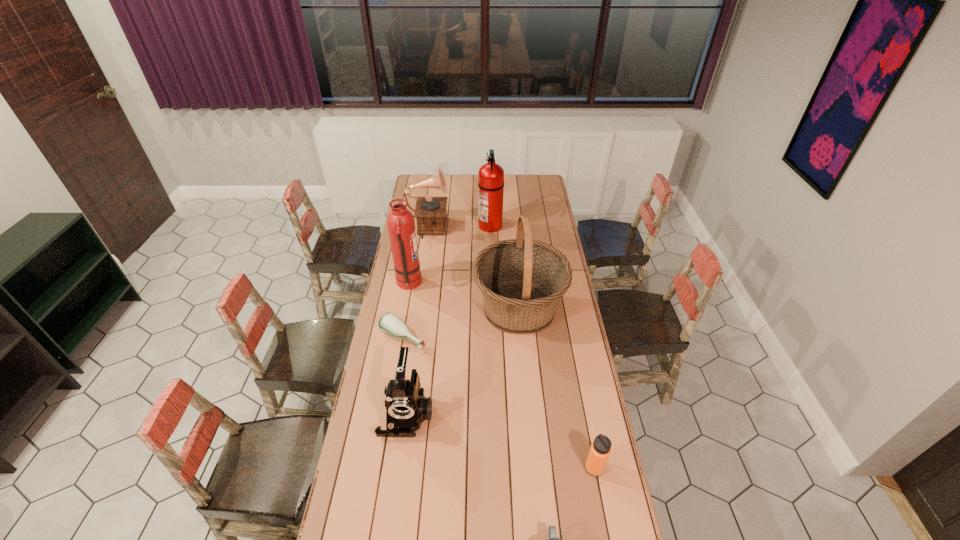
This screenshot has width=960, height=540. In order to click on camcorder that is at the left edge in this screenshot , I will do `click(406, 406)`.

The width and height of the screenshot is (960, 540). Identify the location of bottle that is at the left edge. (392, 325).

The width and height of the screenshot is (960, 540). In order to click on basket that is at the right edge in this screenshot , I will do `click(522, 280)`.

Where is `thermos bottle situated at the right edge`? This screenshot has height=540, width=960. thermos bottle situated at the right edge is located at coordinates (600, 449).

The height and width of the screenshot is (540, 960). Find the location of `blank space at the far edge of the desktop`. blank space at the far edge of the desktop is located at coordinates (518, 192).

The height and width of the screenshot is (540, 960). I want to click on vacant space at the left edge, so point(356,454).

I want to click on vacant point at the right edge, so click(548, 329).

What are the coordinates of `vacant space at the far left corner of the desktop` in the screenshot? It's located at [x=418, y=175].

Where is `vacant space at the far right corner of the desktop`? vacant space at the far right corner of the desktop is located at coordinates (533, 187).

This screenshot has height=540, width=960. In order to click on vacant area that lies between the left fire extinguisher and the basket in this screenshot , I will do `click(464, 296)`.